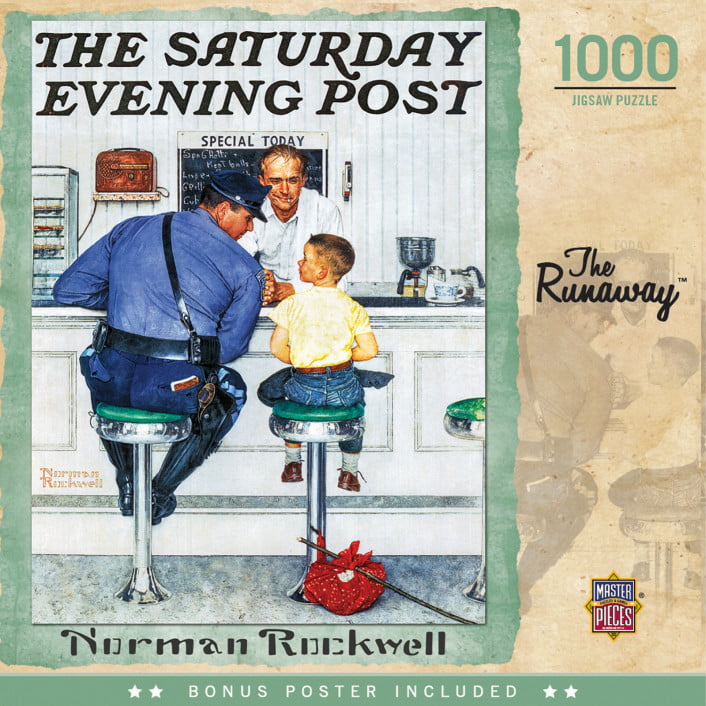
Find the location of a particular element. Image resolution: width=706 pixels, height=706 pixels. stool is located at coordinates (310, 417), (142, 436).